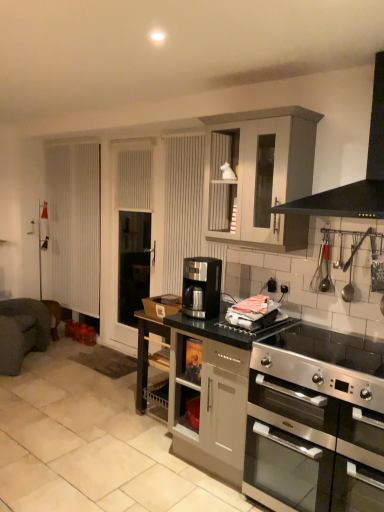
Question: Is stainless steel oven at lower right located within dark gray fabric armchair at left?

Choices:
 (A) yes
 (B) no

Answer: (B)

Question: Can you confirm if dark gray fabric armchair at left is bigger than stainless steel oven at lower right?

Choices:
 (A) yes
 (B) no

Answer: (A)

Question: Does dark gray fabric armchair at left turn towards stainless steel oven at lower right?

Choices:
 (A) no
 (B) yes

Answer: (A)

Question: Does dark gray fabric armchair at left appear on the right side of stainless steel oven at lower right?

Choices:
 (A) yes
 (B) no

Answer: (B)

Question: Is dark gray fabric armchair at left located outside stainless steel oven at lower right?

Choices:
 (A) yes
 (B) no

Answer: (A)

Question: Is dark gray fabric armchair at left facing away from stainless steel oven at lower right?

Choices:
 (A) no
 (B) yes

Answer: (A)

Question: Can you confirm if stainless steel oven at lower right is shorter than satin black coffee machine at center?

Choices:
 (A) no
 (B) yes

Answer: (A)

Question: Does stainless steel oven at lower right have a lesser width compared to satin black coffee machine at center?

Choices:
 (A) yes
 (B) no

Answer: (B)

Question: Considering the relative positions of stainless steel oven at lower right and satin black coffee machine at center in the image provided, is stainless steel oven at lower right in front of satin black coffee machine at center?

Choices:
 (A) no
 (B) yes

Answer: (B)

Question: Is the surface of stainless steel oven at lower right in direct contact with satin black coffee machine at center?

Choices:
 (A) no
 (B) yes

Answer: (A)

Question: Considering the relative sizes of stainless steel oven at lower right and satin black coffee machine at center in the image provided, is stainless steel oven at lower right taller than satin black coffee machine at center?

Choices:
 (A) no
 (B) yes

Answer: (B)

Question: From the image's perspective, is stainless steel oven at lower right under satin black coffee machine at center?

Choices:
 (A) yes
 (B) no

Answer: (A)

Question: Does satin black coffee machine at center lie behind black matte range hood at upper right?

Choices:
 (A) yes
 (B) no

Answer: (A)